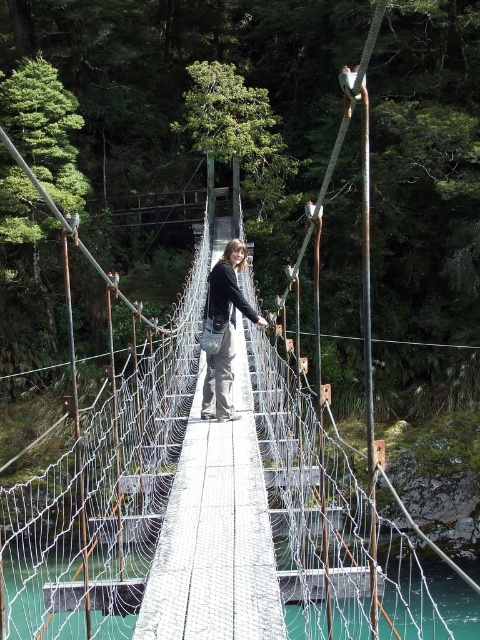
Question: Does matte black jacket at center appear on the right side of teal glassy water at center?

Choices:
 (A) yes
 (B) no

Answer: (B)

Question: Does matte black jacket at center have a larger size compared to teal glassy water at center?

Choices:
 (A) yes
 (B) no

Answer: (B)

Question: Which of the following is the farthest from the observer?

Choices:
 (A) (442, 568)
 (B) (213, 358)

Answer: (A)

Question: Which object is farther from the camera taking this photo?

Choices:
 (A) matte black jacket at center
 (B) teal glassy water at center

Answer: (B)

Question: Is matte black jacket at center below teal glassy water at center?

Choices:
 (A) yes
 (B) no

Answer: (B)